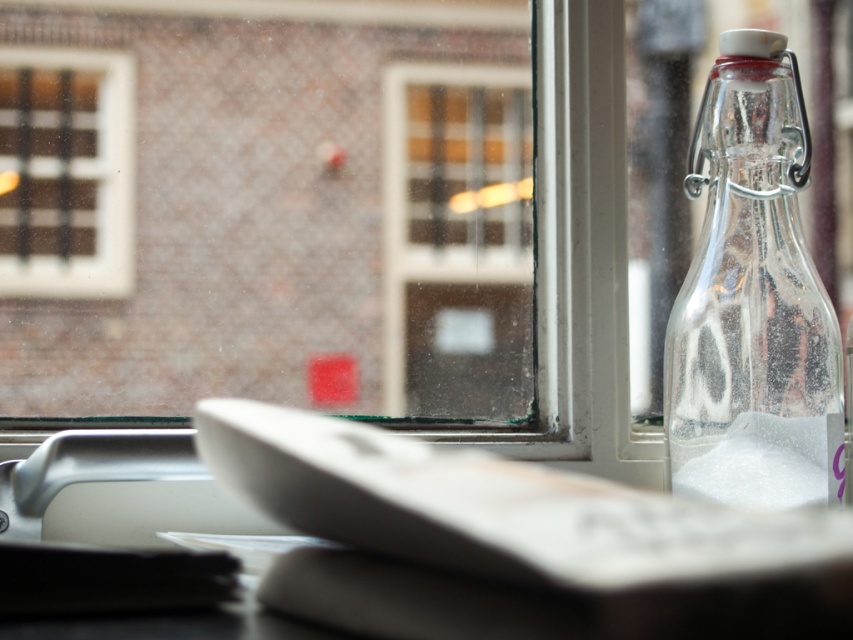
Does clear glass window at center have a smaller size compared to transparent glass window at center?

No, clear glass window at center is not smaller than transparent glass window at center.

Between clear glass window at center and transparent glass window at center, which one is positioned higher?

clear glass window at center is above.

Describe the element at coordinates (268, 205) in the screenshot. I see `clear glass window at center` at that location.

I want to click on clear glass window at center, so click(268, 205).

Does clear glass window at center appear under clear glass bottle at right?

Incorrect, clear glass window at center is not positioned below clear glass bottle at right.

Is clear glass window at center further to camera compared to clear glass bottle at right?

Yes.

Who is more forward, [202,35] or [815,458]?

Point [815,458] is more forward.

I want to click on clear glass window at center, so click(268, 205).

Can you confirm if clear glass window at center is positioned above matte white window at upper left?

No, clear glass window at center is not above matte white window at upper left.

Describe the element at coordinates (268, 205) in the screenshot. I see `clear glass window at center` at that location.

Locate an element on the screen. This screenshot has height=640, width=853. clear glass window at center is located at coordinates (268, 205).